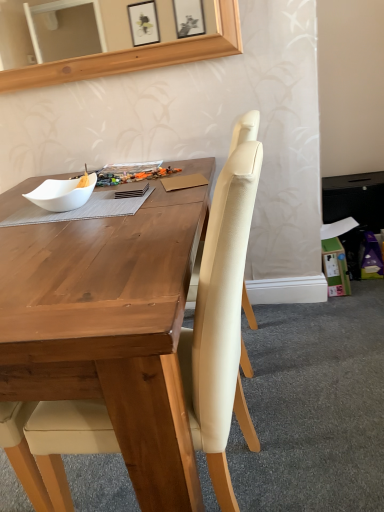
At what (x,y) coordinates should I click in order to perform the action: click on blank space to the left of white matte bowl at left. Please return your answer as a coordinate pair (x, y). Looking at the image, I should click on (15, 218).